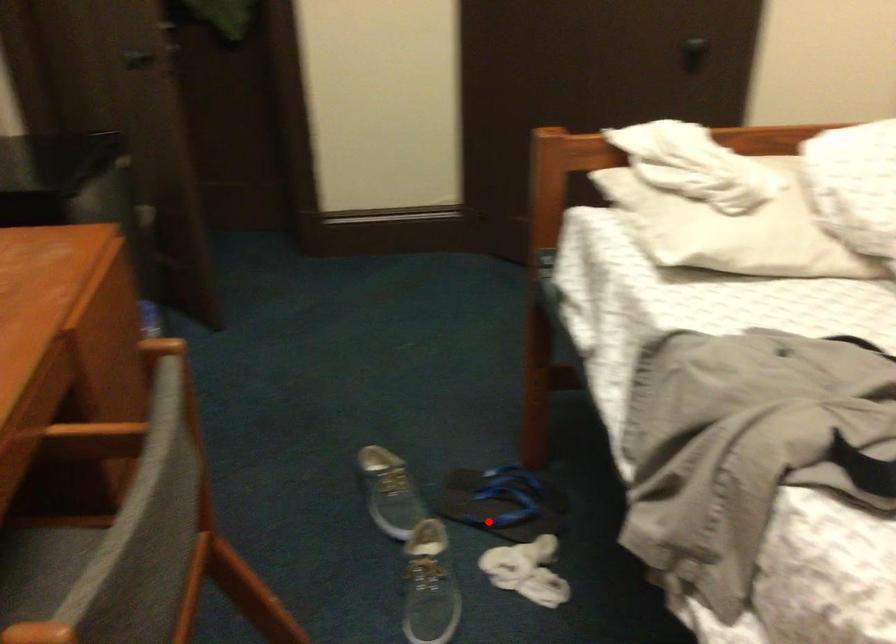
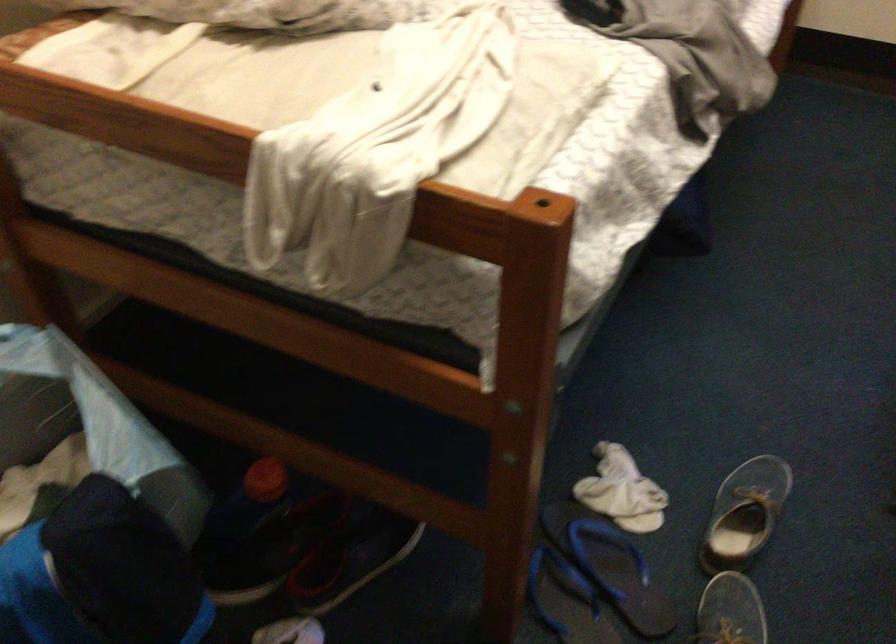
In the second image, find the point that corresponds to the highlighted location in the first image.

(609, 565)